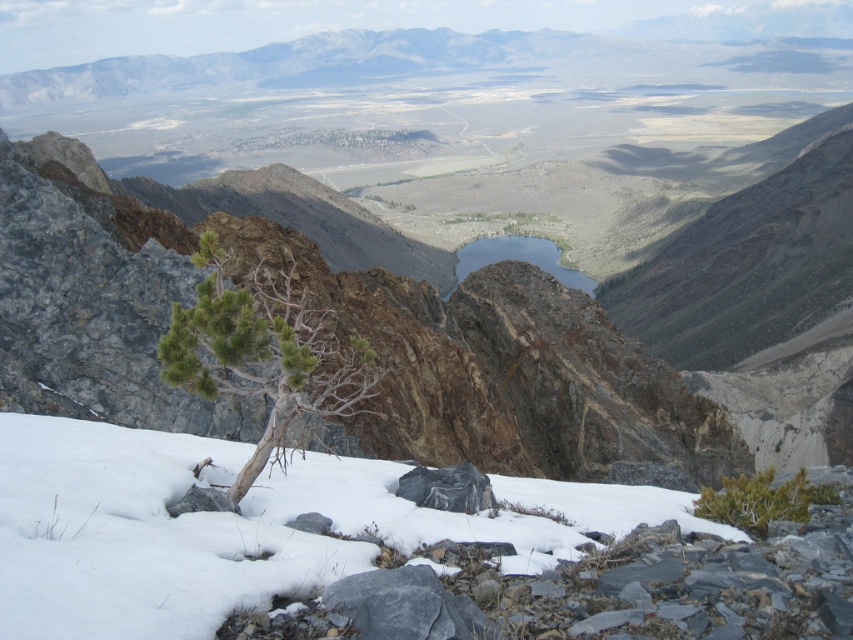
At what (x,y) coordinates should I click in order to perform the action: click on white powdery snow at lower left. Please return your answer as a coordinate pair (x, y). Image resolution: width=853 pixels, height=640 pixels. Looking at the image, I should click on (373, 547).

Who is shorter, white powdery snow at lower left or clear glass lake at center?

Standing shorter between the two is white powdery snow at lower left.

In order to click on white powdery snow at lower left in this screenshot , I will do `click(373, 547)`.

Locate an element on the screen. white powdery snow at lower left is located at coordinates (373, 547).

Is gray/granite rock at center to the left of clear glass lake at center from the viewer's perspective?

Indeed, gray/granite rock at center is positioned on the left side of clear glass lake at center.

Who is taller, gray/granite rock at center or clear glass lake at center?

clear glass lake at center

Describe the element at coordinates (447, 488) in the screenshot. I see `gray/granite rock at center` at that location.

Locate an element on the screen. gray/granite rock at center is located at coordinates (447, 488).

Looking at this image, between green textured shrub at lower right and gray/granite rock at center, which one appears on the left side from the viewer's perspective?

Positioned to the left is gray/granite rock at center.

Who is higher up, green textured shrub at lower right or gray/granite rock at center?

gray/granite rock at center is higher up.

At what (x,y) coordinates should I click in order to perform the action: click on green textured shrub at lower right. Please return your answer as a coordinate pair (x, y). The image size is (853, 640). Looking at the image, I should click on (764, 499).